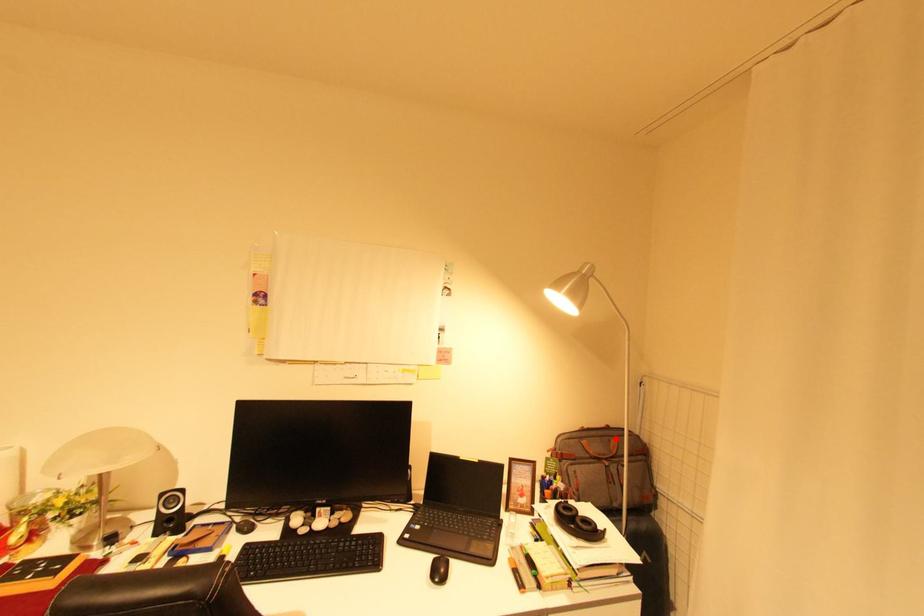
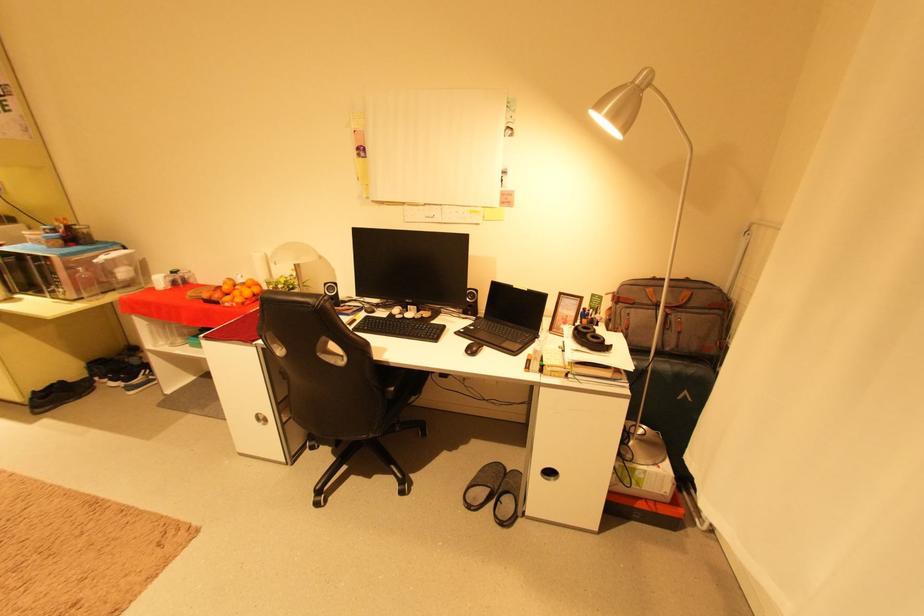
Find the pixel in the second image that matches the highlighted location in the first image.

(688, 290)